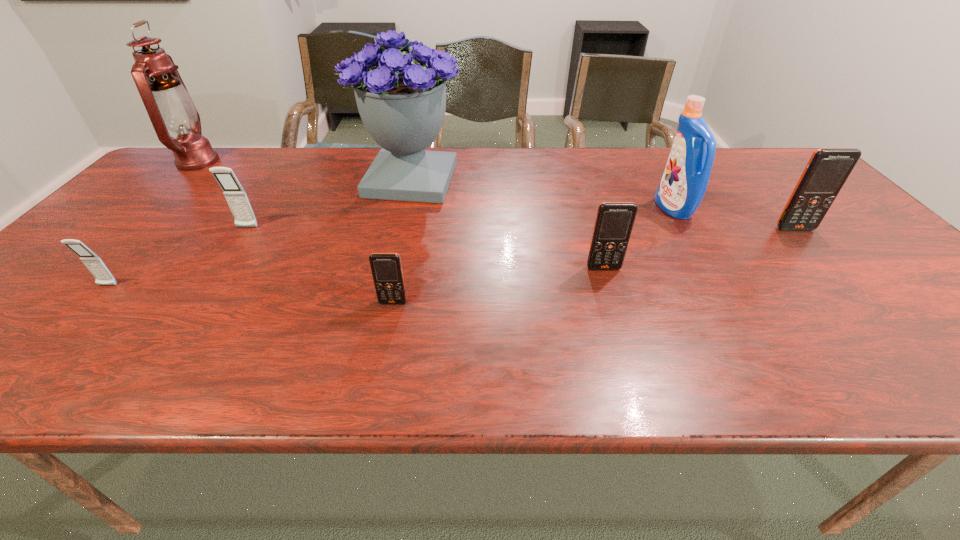
You are a GUI agent. You are given a task and a screenshot of the screen. Output one action in this format:
    pyautogui.click(x=<x>, y=<y>)
    Task: Click on the nearest orange cellular telephone
    
    Given the screenshot: What is the action you would take?
    pyautogui.click(x=386, y=268)

Where is `the nearest cellular telephone`? the nearest cellular telephone is located at coordinates (386, 268).

The image size is (960, 540). In order to click on the fourth farthest cellular telephone in this screenshot , I will do `click(95, 265)`.

At what (x,y) coordinates should I click in order to perform the action: click on the seventh farthest object. Please return your answer as a coordinate pair (x, y). The image size is (960, 540). Looking at the image, I should click on (95, 265).

This screenshot has width=960, height=540. I want to click on free space located on the front of the red oil lamp, so click(100, 259).

The width and height of the screenshot is (960, 540). Find the location of `free location located 0.210m on the front of the purple bouquet`. free location located 0.210m on the front of the purple bouquet is located at coordinates (392, 259).

Locate an element on the screen. The width and height of the screenshot is (960, 540). free spot located 0.060m on the label of the seventh object from left to right is located at coordinates (636, 208).

This screenshot has height=540, width=960. Find the location of `vacant space located on the label of the seventh object from left to right`. vacant space located on the label of the seventh object from left to right is located at coordinates (630, 208).

Find the location of a particular element. The image size is (960, 540). vacant area situated 0.090m on the label of the seventh object from left to right is located at coordinates (626, 208).

Image resolution: width=960 pixels, height=540 pixels. I want to click on blank space located on the screen of the rightmost orange cellular telephone, so click(x=895, y=340).